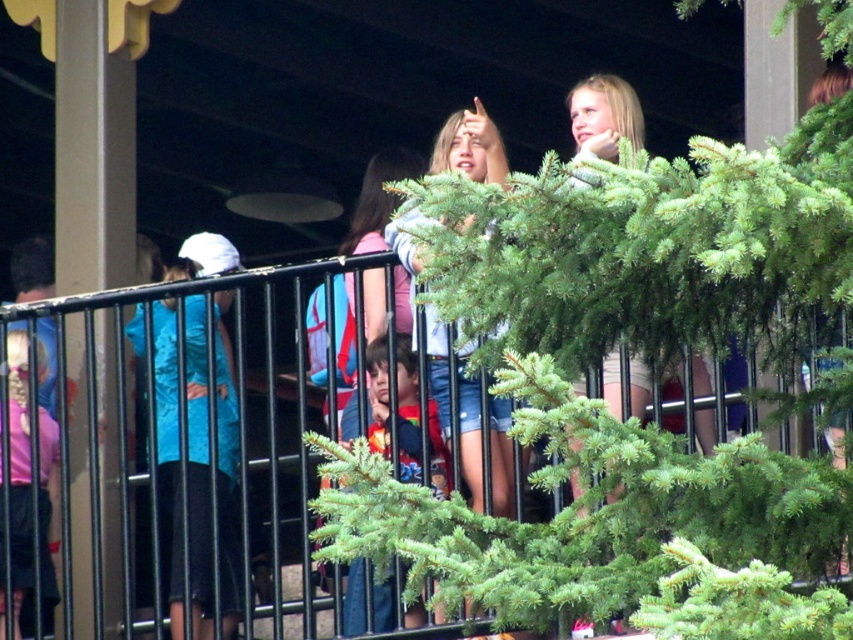
Which is behind, point (248, 384) or point (196, 406)?

The point (248, 384) is more distant.

Is point (672, 445) positioned in front of point (231, 374)?

Yes, it is.

Find the location of a particular element. This screenshot has width=853, height=640. black metal fence at upper center is located at coordinates (171, 445).

Locate an element on the screen. black metal fence at upper center is located at coordinates (171, 445).

Can you confirm if pink matte shorts at lower left is positioned to the left of red shirt at center?

Yes, pink matte shorts at lower left is to the left of red shirt at center.

Is point (12, 547) in front of point (415, 381)?

No, it is not.

Identify the location of pink matte shorts at lower left. The width and height of the screenshot is (853, 640). (19, 474).

Can you confirm if matte blue shirt at center is taller than red shirt at center?

Yes, matte blue shirt at center is taller than red shirt at center.

Does matte blue shirt at center appear on the left side of red shirt at center?

Yes, matte blue shirt at center is to the left of red shirt at center.

Is point (405, 301) closer to camera compared to point (427, 440)?

No, (405, 301) is further to viewer.

Find the location of a particular element. This screenshot has height=640, width=853. matte blue shirt at center is located at coordinates (379, 196).